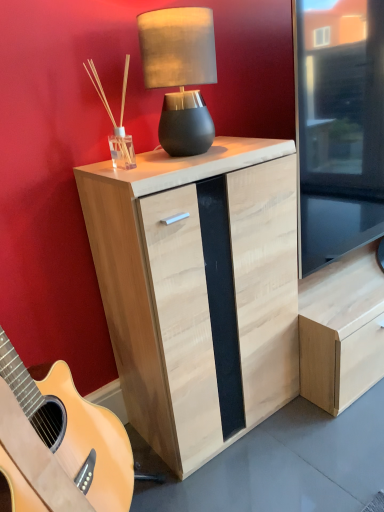
Question: From a real-world perspective, does matte black lamp at upper center stand above natural wood cabinet at center?

Choices:
 (A) no
 (B) yes

Answer: (B)

Question: From the image's perspective, is matte black lamp at upper center beneath natural wood cabinet at center?

Choices:
 (A) yes
 (B) no

Answer: (B)

Question: Is matte black lamp at upper center at the left side of natural wood cabinet at center?

Choices:
 (A) yes
 (B) no

Answer: (A)

Question: Is matte black lamp at upper center aimed at natural wood cabinet at center?

Choices:
 (A) yes
 (B) no

Answer: (B)

Question: Considering the relative sizes of matte black lamp at upper center and natural wood cabinet at center in the image provided, is matte black lamp at upper center taller than natural wood cabinet at center?

Choices:
 (A) yes
 (B) no

Answer: (B)

Question: Considering the relative sizes of matte black lamp at upper center and natural wood cabinet at center in the image provided, is matte black lamp at upper center thinner than natural wood cabinet at center?

Choices:
 (A) no
 (B) yes

Answer: (B)

Question: Does natural wood cabinet at center have a lesser height compared to matte black lamp at upper center?

Choices:
 (A) yes
 (B) no

Answer: (B)

Question: Is natural wood cabinet at center directly adjacent to matte black lamp at upper center?

Choices:
 (A) no
 (B) yes

Answer: (A)

Question: Does natural wood cabinet at center appear on the left side of matte black lamp at upper center?

Choices:
 (A) no
 (B) yes

Answer: (A)

Question: Considering the relative positions of natural wood cabinet at center and matte black lamp at upper center in the image provided, is natural wood cabinet at center behind matte black lamp at upper center?

Choices:
 (A) yes
 (B) no

Answer: (B)

Question: Can you confirm if natural wood cabinet at center is bigger than matte black lamp at upper center?

Choices:
 (A) yes
 (B) no

Answer: (A)

Question: From the image's perspective, would you say natural wood cabinet at center is shown under matte black lamp at upper center?

Choices:
 (A) yes
 (B) no

Answer: (A)

Question: Is natural wood cabinet at center wider or thinner than matte black lamp at upper center?

Choices:
 (A) thin
 (B) wide

Answer: (B)